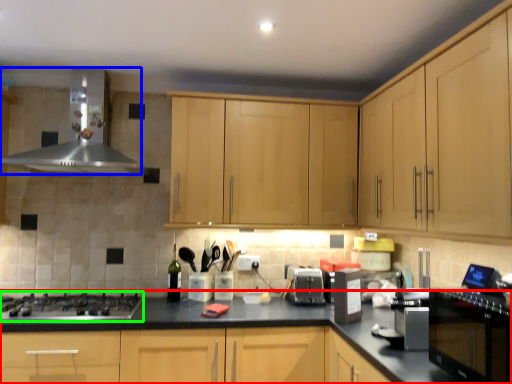
Question: Which object is the farthest from countertop (highlighted by a red box)? Choose among these: home appliance (highlighted by a blue box) or gas stove (highlighted by a green box).

Choices:
 (A) home appliance
 (B) gas stove

Answer: (A)